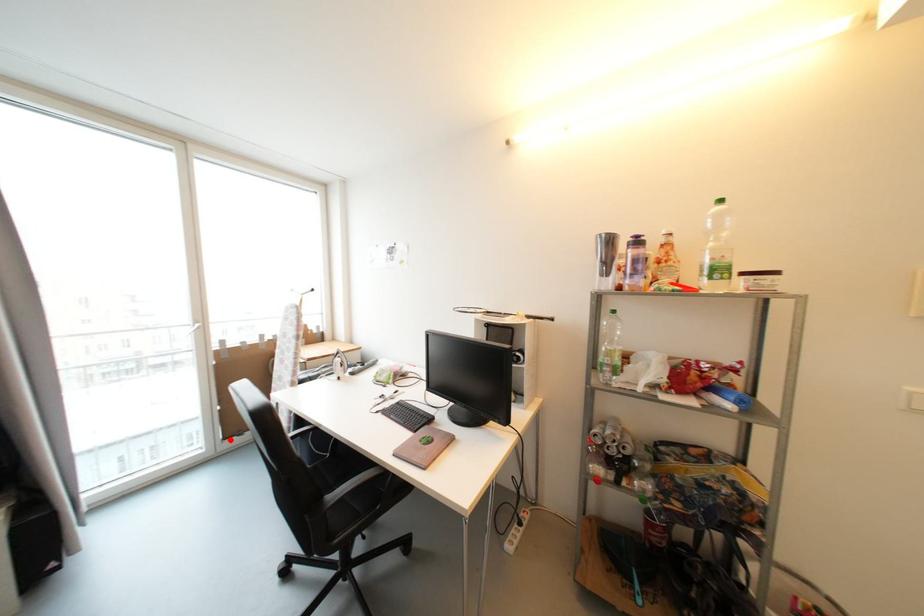
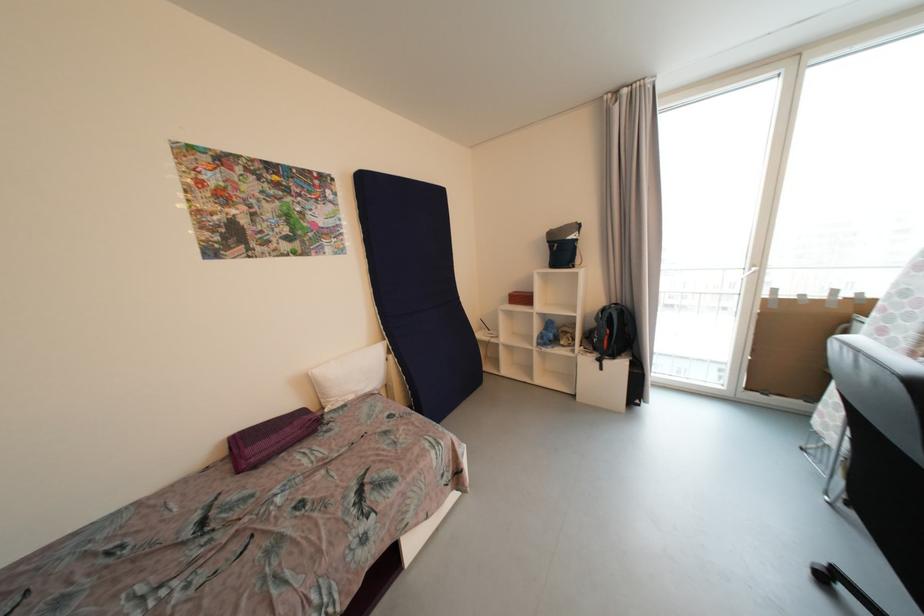
Question: I am providing you with two images of the same scene from different viewpoints. Given a red point in image1, look at the same physical point in image2. Is it:

Choices:
 (A) Closer to the viewpoint
 (B) Farther from the viewpoint

Answer: (A)